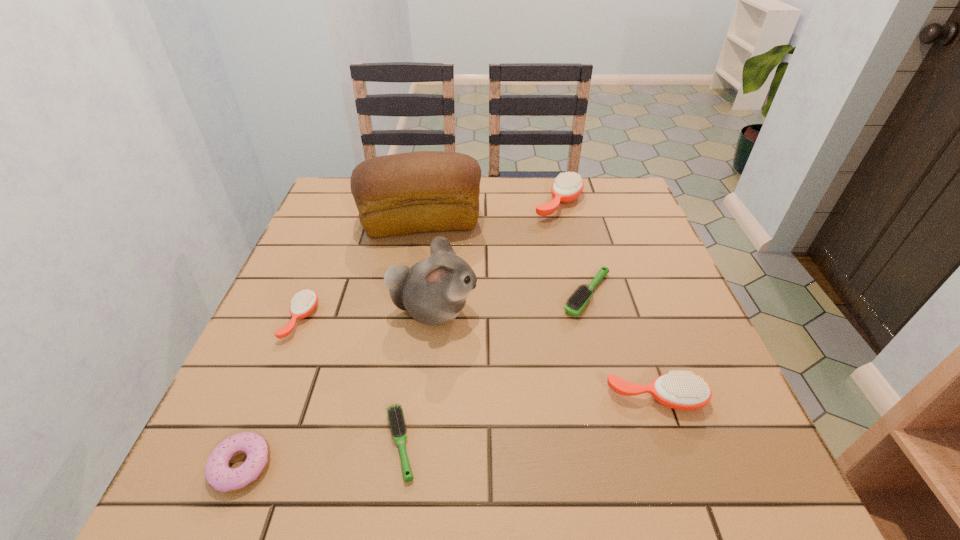
Locate an element on the screen. This screenshot has height=540, width=960. vacant space situated on the right of the fourth tallest hairbrush is located at coordinates (640, 294).

At what (x,y) coordinates should I click in order to perform the action: click on free space located 0.080m on the right of the pink doughnut. Please return your answer as a coordinate pair (x, y). Image resolution: width=960 pixels, height=540 pixels. Looking at the image, I should click on (320, 465).

Find the location of `free space located on the left of the fourth hairbrush from right to left`. free space located on the left of the fourth hairbrush from right to left is located at coordinates (288, 444).

Locate an element on the screen. The image size is (960, 540). bread situated at the far edge is located at coordinates (425, 191).

This screenshot has width=960, height=540. I want to click on hairbrush located in the far edge section of the desktop, so click(x=567, y=186).

You are a GUI agent. You are given a task and a screenshot of the screen. Output one action in this format:
    pyautogui.click(x=<x>, y=<y>)
    Task: Click on the doughnut present at the near edge
    
    Given the screenshot: What is the action you would take?
    pyautogui.click(x=218, y=474)

Image resolution: width=960 pixels, height=540 pixels. Identify the location of hairbrush located in the near edge section of the desktop. (395, 413).

Locate an element on the screen. The image size is (960, 540). bread at the left edge is located at coordinates (425, 191).

The image size is (960, 540). I want to click on hairbrush that is at the left edge, so click(303, 303).

The image size is (960, 540). What are the coordinates of `doughnut located in the left edge section of the desktop` in the screenshot? It's located at (218, 474).